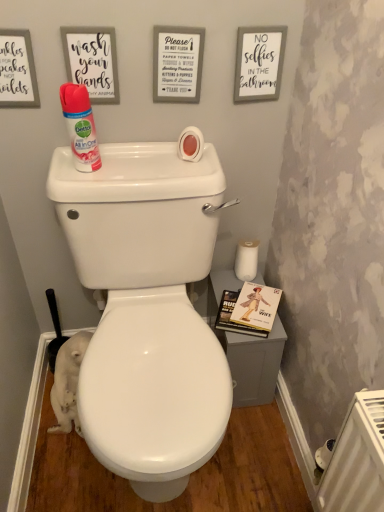
Question: Looking at their shapes, would you say white paper sign at upper center, marked as the second copy in a right-to-left arrangement, is wider or thinner than white matte sign at upper right, which is the first copy in right-to-left order?

Choices:
 (A) thin
 (B) wide

Answer: (B)

Question: In terms of height, does white paper sign at upper center, the third copy viewed from the left, look taller or shorter compared to white matte sign at upper right, which is the first copy in right-to-left order?

Choices:
 (A) short
 (B) tall

Answer: (A)

Question: Considering the real-world distances, which object is farthest from the white glossy toilet at center?

Choices:
 (A) white paper sign at upper left, the 4th copy positioned from the right
 (B) hardcover book at right
 (C) matte pink spray can at upper left
 (D) white plastic radiator at lower right
 (E) white fur cat at lower left

Answer: (A)

Question: Which of these objects is positioned farthest from the white plastic radiator at lower right?

Choices:
 (A) hardcover book at right
 (B) white paper sign at upper center, the third copy viewed from the left
 (C) white paper sign at upper left, placed as the 1th copy when sorted from left to right
 (D) matte pink spray can at upper left
 (E) matte white sign at upper left, the 3th copy from the right

Answer: (C)